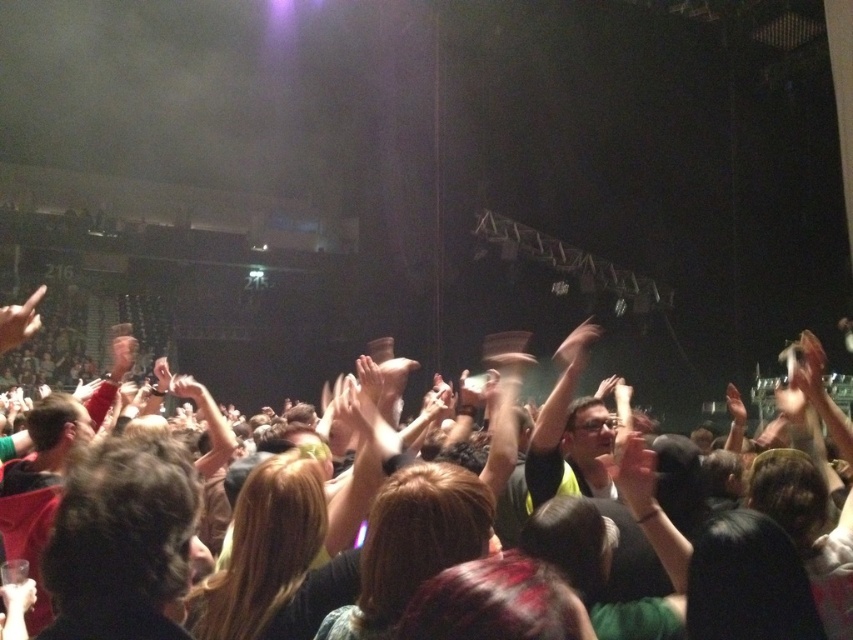
Question: Can you confirm if matte black finger at upper left is bigger than matte black hand at lower left?

Choices:
 (A) yes
 (B) no

Answer: (A)

Question: Among these objects, which one is farthest from the camera?

Choices:
 (A) matte black hand at lower left
 (B) dark brown hair at center
 (C) matte skin hand at upper right

Answer: (C)

Question: Does translucent skin hand at center have a smaller size compared to matte black finger at upper left?

Choices:
 (A) yes
 (B) no

Answer: (A)

Question: Which point is farther to the camera?

Choices:
 (A) (134, 486)
 (B) (0, 317)
 (C) (651, 509)
 (D) (4, 588)

Answer: (B)

Question: Does dark brown hair at center appear on the left side of matte black finger at upper left?

Choices:
 (A) yes
 (B) no

Answer: (B)

Question: Which object appears closest to the camera in this image?

Choices:
 (A) translucent skin hand at center
 (B) matte black hand at lower left

Answer: (B)